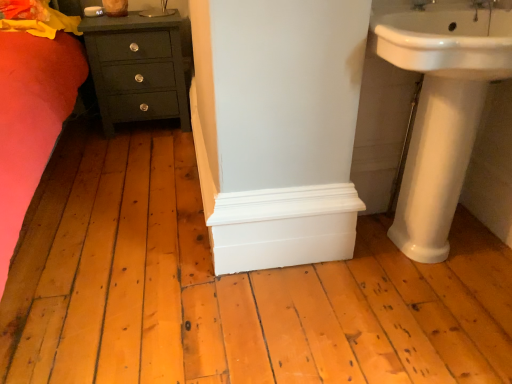
Describe the element at coordinates (447, 42) in the screenshot. The image size is (512, 384). I see `white glossy sink at upper right, which ranks as the 2th sink in bottom-to-top order` at that location.

In order to click on matte dark green chest of drawers at lower left in this screenshot , I will do `click(137, 68)`.

From a real-world perspective, which object stands above the other?

From a 3D spatial view, white glossy sink at upper right, which ranks as the first sink in top-to-bottom order, is above.

Consider the image. Between white glossy sink at upper right, which ranks as the 2th sink in bottom-to-top order, and matte dark green chest of drawers at lower left, which one has smaller size?

With smaller size is white glossy sink at upper right, which ranks as the 2th sink in bottom-to-top order.

From the image's perspective, which is above, white glossy sink at upper right, which ranks as the 2th sink in bottom-to-top order, or matte dark green chest of drawers at lower left?

matte dark green chest of drawers at lower left is shown above in the image.

Is white glossy sink at upper right, which ranks as the 2th sink in bottom-to-top order, looking in the opposite direction of white ceramic tap at upper right?

That's not correct — white glossy sink at upper right, which ranks as the 2th sink in bottom-to-top order, is not looking away from white ceramic tap at upper right.

This screenshot has height=384, width=512. I want to click on tap behind the white glossy sink at upper right, which ranks as the 2th sink in bottom-to-top order, so click(x=421, y=4).

Considering the sizes of objects white glossy sink at upper right, which ranks as the 2th sink in bottom-to-top order, and white ceramic tap at upper right in the image provided, who is bigger, white glossy sink at upper right, which ranks as the 2th sink in bottom-to-top order, or white ceramic tap at upper right?

With larger size is white glossy sink at upper right, which ranks as the 2th sink in bottom-to-top order.

Which object is thinner, white glossy sink at upper right, which ranks as the 2th sink in bottom-to-top order, or white ceramic tap at upper right?

white ceramic tap at upper right.

Does white glossy sink at upper right, which ranks as the 2th sink in bottom-to-top order, have a larger size compared to white glossy pedestal sink at right, which ranks as the first sink in bottom-to-top order?

Correct, white glossy sink at upper right, which ranks as the 2th sink in bottom-to-top order, is larger in size than white glossy pedestal sink at right, which ranks as the first sink in bottom-to-top order.

You are a GUI agent. You are given a task and a screenshot of the screen. Output one action in this format:
    pyautogui.click(x=<x>, y=<y>)
    Task: Click on the sink on the right side of white glossy pedestal sink at right, which is the second sink in top-to-bottom order
    This screenshot has width=512, height=384.
    Given the screenshot: What is the action you would take?
    pyautogui.click(x=447, y=42)

Could you tell me if white glossy sink at upper right, which ranks as the 2th sink in bottom-to-top order, is facing white glossy pedestal sink at right, which is the second sink in top-to-bottom order?

No.

Which is more to the right, white glossy sink at upper right, which ranks as the 2th sink in bottom-to-top order, or white glossy pedestal sink at right, which ranks as the first sink in bottom-to-top order?

Positioned to the right is white glossy sink at upper right, which ranks as the 2th sink in bottom-to-top order.

Is white glossy pedestal sink at right, which is the second sink in top-to-bottom order, wider or thinner than matte dark green chest of drawers at lower left?

Considering their sizes, white glossy pedestal sink at right, which is the second sink in top-to-bottom order, looks slimmer than matte dark green chest of drawers at lower left.

Is matte dark green chest of drawers at lower left at the back of white glossy pedestal sink at right, which is the second sink in top-to-bottom order?

No, matte dark green chest of drawers at lower left is not at the back of white glossy pedestal sink at right, which is the second sink in top-to-bottom order.

Is the depth of white glossy pedestal sink at right, which is the second sink in top-to-bottom order, less than that of matte dark green chest of drawers at lower left?

Yes.

Is white glossy pedestal sink at right, which is the second sink in top-to-bottom order, not close to matte dark green chest of drawers at lower left?

Yes, white glossy pedestal sink at right, which is the second sink in top-to-bottom order, is far from matte dark green chest of drawers at lower left.

From a real-world perspective, does white ceramic tap at upper right sit lower than white glossy sink at upper right, which ranks as the first sink in top-to-bottom order?

No, from a real-world perspective, white ceramic tap at upper right is not under white glossy sink at upper right, which ranks as the first sink in top-to-bottom order.

Considering the sizes of objects white ceramic tap at upper right and white glossy sink at upper right, which ranks as the first sink in top-to-bottom order, in the image provided, who is smaller, white ceramic tap at upper right or white glossy sink at upper right, which ranks as the first sink in top-to-bottom order,?

Smaller between the two is white ceramic tap at upper right.

Are white ceramic tap at upper right and white glossy sink at upper right, which ranks as the first sink in top-to-bottom order, far apart?

white ceramic tap at upper right is actually quite close to white glossy sink at upper right, which ranks as the first sink in top-to-bottom order.

From the image's perspective, which one is positioned higher, white glossy pedestal sink at right, which is the second sink in top-to-bottom order, or white glossy sink at upper right, which ranks as the first sink in top-to-bottom order?

From the image's view, white glossy sink at upper right, which ranks as the first sink in top-to-bottom order, is above.

Considering the points (420, 21) and (480, 13), which point is behind, point (420, 21) or point (480, 13)?

Positioned behind is point (480, 13).

Is white glossy pedestal sink at right, which is the second sink in top-to-bottom order, facing away from white glossy sink at upper right, which ranks as the first sink in top-to-bottom order?

No, white glossy pedestal sink at right, which is the second sink in top-to-bottom order,'s orientation is not away from white glossy sink at upper right, which ranks as the first sink in top-to-bottom order.

Locate an element on the screen. This screenshot has height=384, width=512. sink on the right of white glossy pedestal sink at right, which is the second sink in top-to-bottom order is located at coordinates (447, 42).

Considering the relative sizes of matte dark green chest of drawers at lower left and white glossy pedestal sink at right, which is the second sink in top-to-bottom order, in the image provided, is matte dark green chest of drawers at lower left thinner than white glossy pedestal sink at right, which is the second sink in top-to-bottom order,?

No.

Is matte dark green chest of drawers at lower left oriented away from white glossy pedestal sink at right, which is the second sink in top-to-bottom order?

That's not correct — matte dark green chest of drawers at lower left is not looking away from white glossy pedestal sink at right, which is the second sink in top-to-bottom order.

Considering the sizes of objects matte dark green chest of drawers at lower left and white glossy pedestal sink at right, which ranks as the first sink in bottom-to-top order, in the image provided, who is bigger, matte dark green chest of drawers at lower left or white glossy pedestal sink at right, which ranks as the first sink in bottom-to-top order,?

With larger size is matte dark green chest of drawers at lower left.

From a real-world perspective, is matte dark green chest of drawers at lower left below white glossy pedestal sink at right, which ranks as the first sink in bottom-to-top order?

Yes, from a real-world perspective, matte dark green chest of drawers at lower left is under white glossy pedestal sink at right, which ranks as the first sink in bottom-to-top order.

From the matte dark green chest of drawers at lower left, count 2nd sinks forward and point to it. Please provide its 2D coordinates.

[(447, 42)]

This screenshot has height=384, width=512. I want to click on tap above the white glossy sink at upper right, which ranks as the 2th sink in bottom-to-top order (from the image's perspective), so click(x=421, y=4).

Based on their spatial positions, is matte dark green chest of drawers at lower left or white glossy sink at upper right, which ranks as the 2th sink in bottom-to-top order, closer to white ceramic tap at upper right?

white glossy sink at upper right, which ranks as the 2th sink in bottom-to-top order, lies closer to white ceramic tap at upper right than the other object.

Estimate the real-world distances between objects in this image. Which object is closer to white glossy pedestal sink at right, which is the second sink in top-to-bottom order, white glossy sink at upper right, which ranks as the 2th sink in bottom-to-top order, or white ceramic tap at upper right?

Based on the image, white glossy sink at upper right, which ranks as the 2th sink in bottom-to-top order, appears to be nearer to white glossy pedestal sink at right, which is the second sink in top-to-bottom order.

Which object lies further to the anchor point white ceramic tap at upper right, white glossy pedestal sink at right, which is the second sink in top-to-bottom order, or matte dark green chest of drawers at lower left?

matte dark green chest of drawers at lower left.

Estimate the real-world distances between objects in this image. Which object is closer to matte dark green chest of drawers at lower left, white ceramic tap at upper right or white glossy sink at upper right, which ranks as the first sink in top-to-bottom order?

Based on the image, white glossy sink at upper right, which ranks as the first sink in top-to-bottom order, appears to be nearer to matte dark green chest of drawers at lower left.

When comparing their distances from white ceramic tap at upper right, does matte dark green chest of drawers at lower left or white glossy pedestal sink at right, which ranks as the first sink in bottom-to-top order, seem further?

matte dark green chest of drawers at lower left is positioned further to the anchor white ceramic tap at upper right.

Consider the image. Which object lies further to the anchor point white glossy sink at upper right, which ranks as the 2th sink in bottom-to-top order, white ceramic tap at upper right or white glossy pedestal sink at right, which ranks as the first sink in bottom-to-top order?

The object further to white glossy sink at upper right, which ranks as the 2th sink in bottom-to-top order, is white ceramic tap at upper right.

Estimate the real-world distances between objects in this image. Which object is closer to white glossy sink at upper right, which ranks as the 2th sink in bottom-to-top order, white glossy pedestal sink at right, which is the second sink in top-to-bottom order, or white ceramic tap at upper right?

The object closer to white glossy sink at upper right, which ranks as the 2th sink in bottom-to-top order, is white glossy pedestal sink at right, which is the second sink in top-to-bottom order.

Based on their spatial positions, is white glossy sink at upper right, which ranks as the 2th sink in bottom-to-top order, or matte dark green chest of drawers at lower left closer to white glossy pedestal sink at right, which is the second sink in top-to-bottom order?

The object closer to white glossy pedestal sink at right, which is the second sink in top-to-bottom order, is white glossy sink at upper right, which ranks as the 2th sink in bottom-to-top order.

Where is `tap located between matte dark green chest of drawers at lower left and white glossy sink at upper right, which ranks as the first sink in top-to-bottom order, in the left-right direction`? The height and width of the screenshot is (384, 512). tap located between matte dark green chest of drawers at lower left and white glossy sink at upper right, which ranks as the first sink in top-to-bottom order, in the left-right direction is located at coordinates [421, 4].

In order to click on sink located between matte dark green chest of drawers at lower left and white glossy sink at upper right, which ranks as the first sink in top-to-bottom order, in the left-right direction in this screenshot , I will do `click(441, 112)`.

You are a GUI agent. You are given a task and a screenshot of the screen. Output one action in this format:
    pyautogui.click(x=<x>, y=<y>)
    Task: Click on the tap situated between matte dark green chest of drawers at lower left and white glossy pedestal sink at right, which ranks as the first sink in bottom-to-top order, from left to right
    The width and height of the screenshot is (512, 384).
    Given the screenshot: What is the action you would take?
    pyautogui.click(x=421, y=4)

You are a GUI agent. You are given a task and a screenshot of the screen. Output one action in this format:
    pyautogui.click(x=<x>, y=<y>)
    Task: Click on the sink between white ceramic tap at upper right and white glossy pedestal sink at right, which is the second sink in top-to-bottom order, vertically
    Image resolution: width=512 pixels, height=384 pixels.
    Given the screenshot: What is the action you would take?
    pyautogui.click(x=447, y=42)